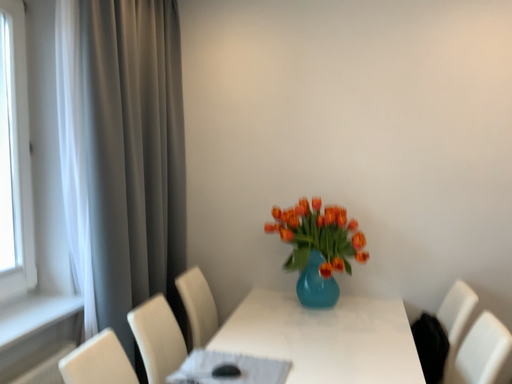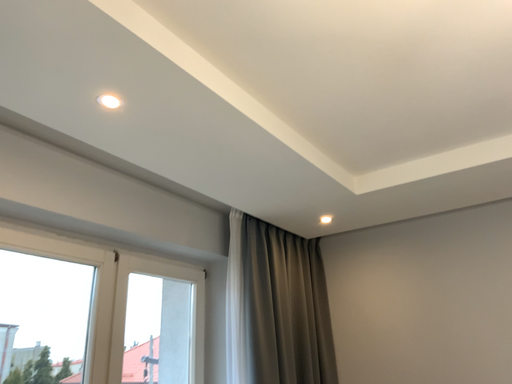
Question: Which way did the camera rotate in the video?

Choices:
 (A) rotated right
 (B) rotated left

Answer: (B)